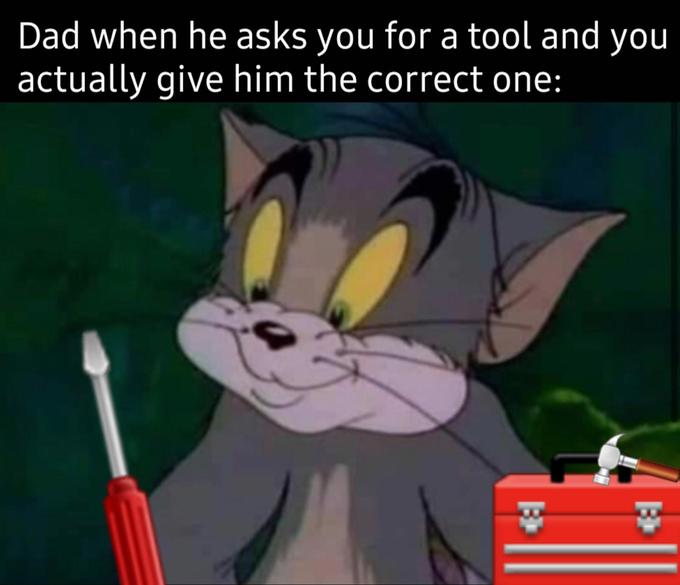
Where is `wooden handle`? wooden handle is located at coordinates (649, 469).